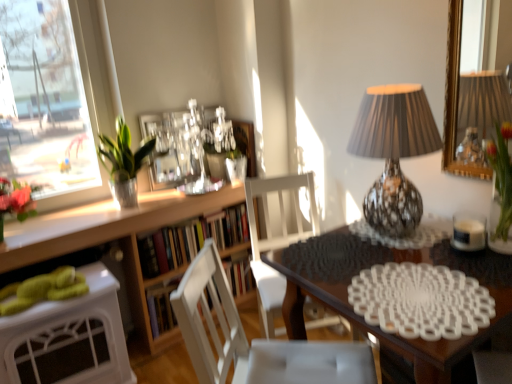
Locate an element on the screen. wooden bookshelf at center is located at coordinates (191, 240).

Describe the element at coordinates (275, 241) in the screenshot. I see `white matte chair at center, arranged as the 1th chair when viewed from the back` at that location.

Locate an element on the screen. The width and height of the screenshot is (512, 384). wooden bookshelf at center is located at coordinates (186, 266).

I want to click on green leafy plant in glass vase at upper left, so click(x=123, y=163).

Describe the element at coordinates (394, 153) in the screenshot. The image size is (512, 384). I see `shiny metallic lamp at upper right` at that location.

You are a GUI agent. You are given a task and a screenshot of the screen. Output one action in this format:
    pyautogui.click(x=<x>, y=<y>)
    Task: Click on the wooden bookshelf at center
    
    Given the screenshot: What is the action you would take?
    pyautogui.click(x=191, y=240)

Considering the points (455, 227) and (334, 358), which point is in front, point (455, 227) or point (334, 358)?

Point (334, 358)

From a real-world perspective, is white glass candle at right located beneath white wood chair at center, the 2th chair from the back?

No, from a real-world perspective, white glass candle at right is not under white wood chair at center, the 2th chair from the back.

Looking at this image, are white glass candle at right and white wood chair at center, arranged as the 1th chair when viewed from the front, located far from each other?

white glass candle at right is near white wood chair at center, arranged as the 1th chair when viewed from the front, not far away.

Based on the photo, can you confirm if green leafy plant in glass vase at upper left is shorter than white glossy desk at lower left?

Indeed, green leafy plant in glass vase at upper left has a lesser height compared to white glossy desk at lower left.

Which of these two, green leafy plant in glass vase at upper left or white glossy desk at lower left, is thinner?

green leafy plant in glass vase at upper left is thinner.

Can you tell me how much green leafy plant in glass vase at upper left and white glossy desk at lower left differ in facing direction?

The angle between the facing direction of green leafy plant in glass vase at upper left and the facing direction of white glossy desk at lower left is 5.89e-05 degrees.

From a real-world perspective, is green leafy plant in glass vase at upper left positioned above or below white glossy desk at lower left?

Clearly, from a real-world perspective, green leafy plant in glass vase at upper left is above white glossy desk at lower left.

Consider the image. Who is taller, shiny metallic lamp at upper right or wooden bookshelf at center?

shiny metallic lamp at upper right.

Find the location of a particular element. This screenshot has height=384, width=512. book located underneath the shiny metallic lamp at upper right (from a real-world perspective) is located at coordinates (191, 240).

Is shiny metallic lamp at upper right not near wooden bookshelf at center?

shiny metallic lamp at upper right is near wooden bookshelf at center, not far away.

Between shiny metallic lamp at upper right and wooden bookshelf at center, which one has larger width?

shiny metallic lamp at upper right.

From a real-world perspective, is translucent glass table at center physically below green glass vase at upper right?

Yes, from a real-world perspective, translucent glass table at center is beneath green glass vase at upper right.

Which is more to the right, translucent glass table at center or green glass vase at upper right?

Positioned to the right is green glass vase at upper right.

Can you confirm if translucent glass table at center is smaller than green glass vase at upper right?

No.

Is white wood chair at center, the 2th chair from the back, far away from green leafy plant in glass vase at upper left?

No.

Looking at this image, is green leafy plant in glass vase at upper left at the back of white wood chair at center, the 2th chair from the back?

white wood chair at center, the 2th chair from the back, is not turned away from green leafy plant in glass vase at upper left.

How many degrees apart are the facing directions of white wood chair at center, arranged as the 1th chair when viewed from the front, and green leafy plant in glass vase at upper left?

They differ by 47.1 degrees in their facing directions.

Locate an element on the screen. desk behind the white glass candle at right is located at coordinates (69, 336).

Considering the relative sizes of white glass candle at right and white glossy desk at lower left in the image provided, is white glass candle at right bigger than white glossy desk at lower left?

Incorrect, white glass candle at right is not larger than white glossy desk at lower left.

Which object is closer to the camera, white glass candle at right or white glossy desk at lower left?

white glass candle at right is in front.

In the scene shown: Is the depth of wooden bookshelf at center less than that of shiny metallic lamp at upper right?

No, it is behind shiny metallic lamp at upper right.

Does wooden bookshelf at center turn towards shiny metallic lamp at upper right?

No, wooden bookshelf at center is not facing towards shiny metallic lamp at upper right.

Looking at this image, is wooden bookshelf at center located outside shiny metallic lamp at upper right?

Absolutely, wooden bookshelf at center is external to shiny metallic lamp at upper right.

From the image's perspective, which chair is the 2nd one below the white glass candle at right? Please provide its 2D coordinates.

[(254, 339)]

The height and width of the screenshot is (384, 512). Find the location of `houseplant on the right of white glossy desk at lower left`. houseplant on the right of white glossy desk at lower left is located at coordinates point(123,163).

Considering their positions, is green leafy plant in glass vase at upper left positioned closer to shiny metallic lamp at upper right than wooden bookshelf at center?

The object closer to shiny metallic lamp at upper right is wooden bookshelf at center.

Looking at the image, which one is located closer to white wood chair at center, the 2th chair from the back, shiny metallic lamp at upper right or white glass candle at right?

Based on the image, shiny metallic lamp at upper right appears to be nearer to white wood chair at center, the 2th chair from the back.

Considering their positions, is white wood chair at center, the 2th chair from the back, positioned further to green leafy plant in glass vase at upper left than white matte chair at center, the 2th chair in the front-to-back sequence?

white wood chair at center, the 2th chair from the back, is positioned further to the anchor green leafy plant in glass vase at upper left.

When comparing their distances from green glass vase at upper right, does wooden bookshelf at center or wooden bookshelf at center seem closer?

Based on the image, wooden bookshelf at center appears to be nearer to green glass vase at upper right.

Based on their spatial positions, is white glossy desk at lower left or white matte chair at center, the 2th chair in the front-to-back sequence, further from clear glass picture frame at upper center?

Among the two, white glossy desk at lower left is located further to clear glass picture frame at upper center.

Considering their positions, is shiny metallic lamp at upper right positioned closer to wooden bookshelf at center than wooden bookshelf at center?

The object closer to wooden bookshelf at center is wooden bookshelf at center.

Based on the photo, from the image, which object appears to be farther from white wood chair at center, the 2th chair from the back, clear glass picture frame at upper center or translucent glass table at center?

Among the two, clear glass picture frame at upper center is located further to white wood chair at center, the 2th chair from the back.

When comparing their distances from green glass vase at upper right, does white glossy desk at lower left or white matte chair at center, the 2th chair in the front-to-back sequence, seem further?

white glossy desk at lower left is positioned further to the anchor green glass vase at upper right.

The height and width of the screenshot is (384, 512). I want to click on book between white glossy desk at lower left and white glass candle at right, so click(191, 240).

Image resolution: width=512 pixels, height=384 pixels. Identify the location of book between clear glass picture frame at upper center and green glass vase at upper right. (191, 240).

I want to click on floral arrangement located between white wood chair at center, arranged as the 1th chair when viewed from the front, and clear glass picture frame at upper center in the depth direction, so click(502, 177).

I want to click on book between green leafy plant in glass vase at upper left and white glass candle at right from left to right, so click(x=191, y=240).